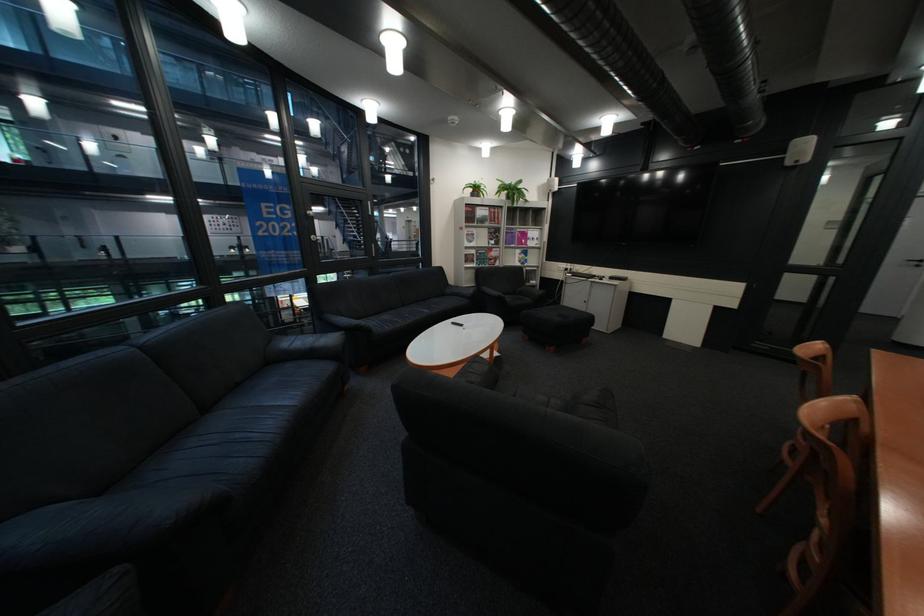
I want to click on white remote control, so click(x=456, y=322).